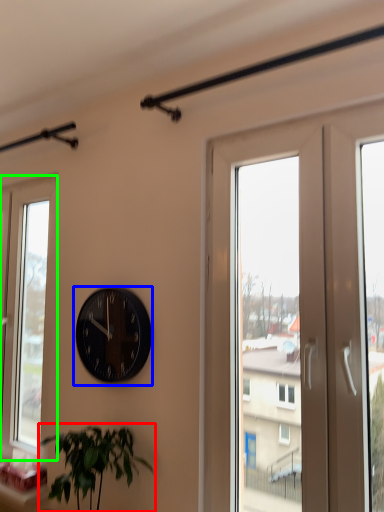
Question: Estimate the real-world distances between objects in this image. Which object is closer to houseplant (highlighted by a red box), wall clock (highlighted by a blue box) or window (highlighted by a green box)?

Choices:
 (A) wall clock
 (B) window

Answer: (A)